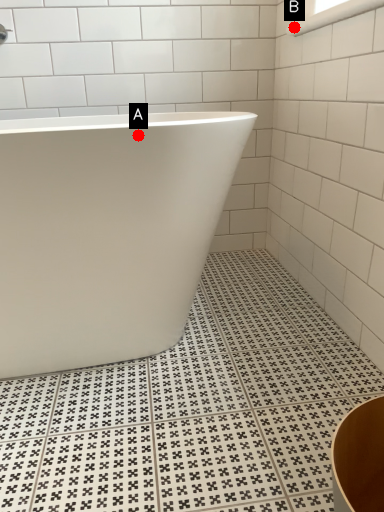
Question: Two points are circled on the image, labeled by A and B beside each circle. Which point is closer to the camera taking this photo?

Choices:
 (A) A is closer
 (B) B is closer

Answer: (A)